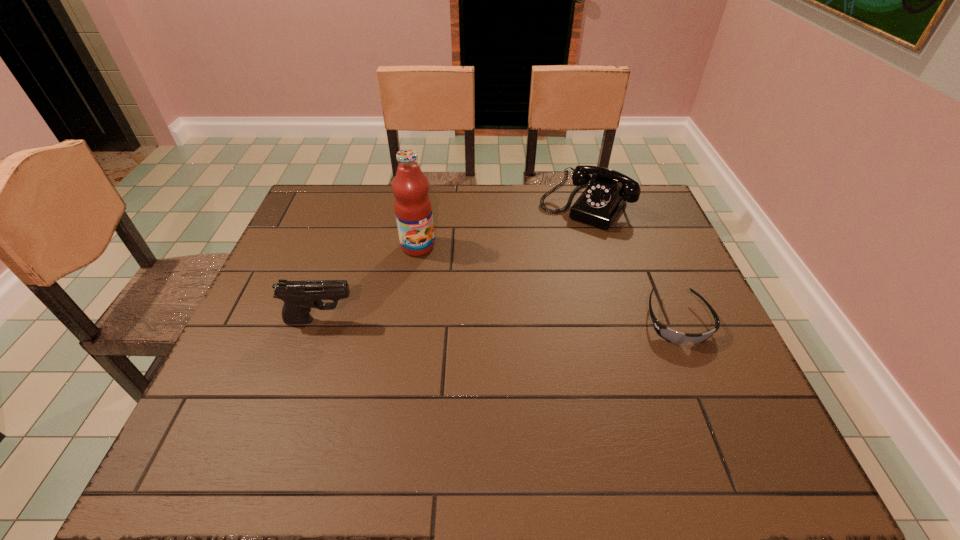
Locate an element on the screen. The image size is (960, 540). free spot on the desktop that is between the pistol and the sunglasses and is positioned on the front label of the second farthest object is located at coordinates (472, 321).

The image size is (960, 540). I want to click on vacant space on the desktop that is between the pistol and the shortest object and is positioned on the dial of the telephone, so click(499, 321).